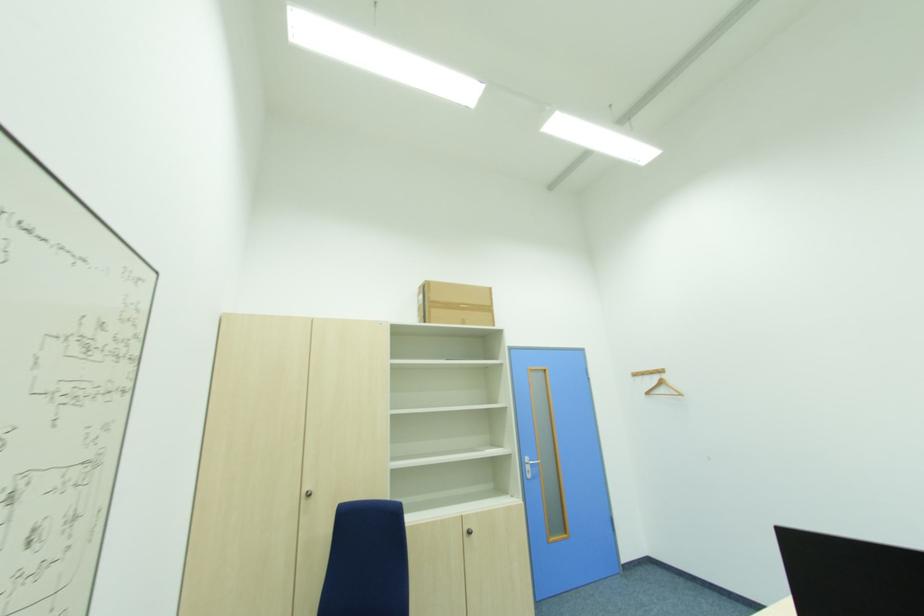
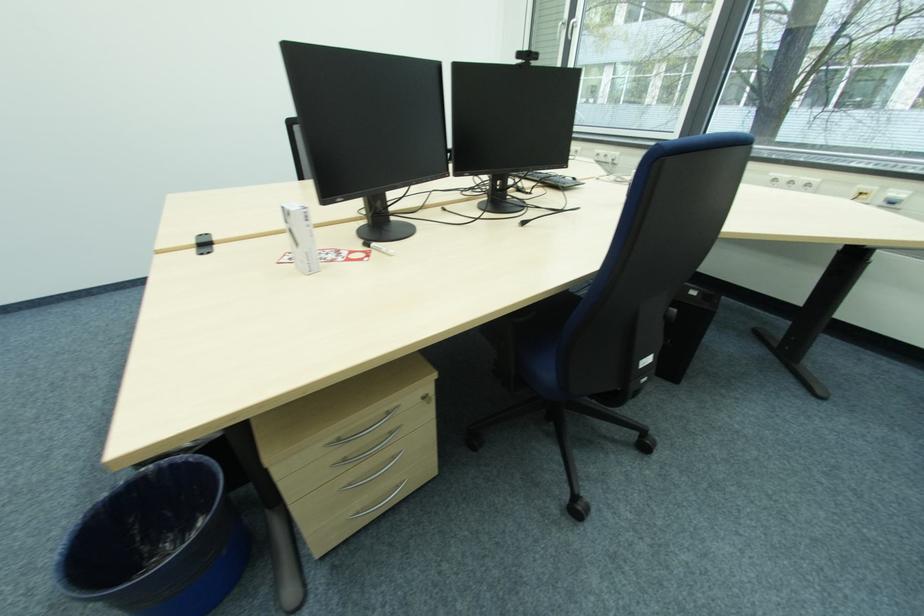
First-person continuous shooting, in which direction is the camera rotating?

The camera's rotation is toward right-down.